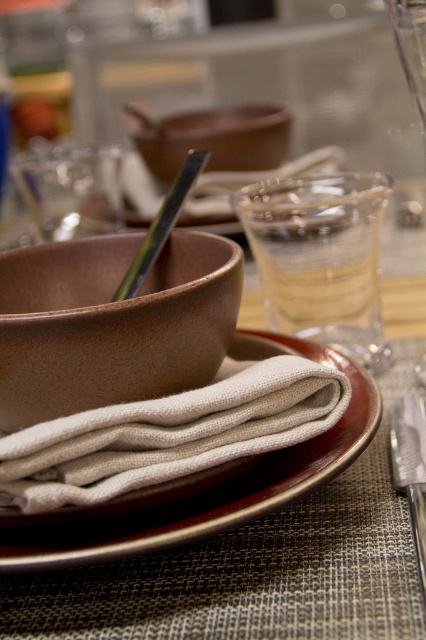
Is brown matte plate at center shorter than polished silver knife at lower right?

In fact, brown matte plate at center may be taller than polished silver knife at lower right.

Can you confirm if brown matte plate at center is positioned below polished silver knife at lower right?

No, brown matte plate at center is not below polished silver knife at lower right.

What are the coordinates of `brown matte plate at center` in the screenshot? It's located at (210, 486).

Does matte brown bowl at center have a smaller size compared to polished silver knife at lower right?

Incorrect, matte brown bowl at center is not smaller in size than polished silver knife at lower right.

From the picture: Does matte brown bowl at center have a larger size compared to polished silver knife at lower right?

Correct, matte brown bowl at center is larger in size than polished silver knife at lower right.

Where is `matte brown bowl at center`? The height and width of the screenshot is (640, 426). matte brown bowl at center is located at coordinates (213, 138).

What are the coordinates of `matte brown bowl at center` in the screenshot? It's located at tap(213, 138).

You are a GUI agent. You are given a task and a screenshot of the screen. Output one action in this format:
    pyautogui.click(x=<x>, y=<y>)
    Task: Click on the brown matte bowl at center
    
    Given the screenshot: What is the action you would take?
    pyautogui.click(x=111, y=323)

Is brown matte bowl at center thinner than matte brown bowl at center?

Correct, brown matte bowl at center's width is less than matte brown bowl at center's.

Which is in front, point (97, 240) or point (239, 134)?

Point (97, 240) is more forward.

Where is `brown matte bowl at center`? The image size is (426, 640). brown matte bowl at center is located at coordinates [111, 323].